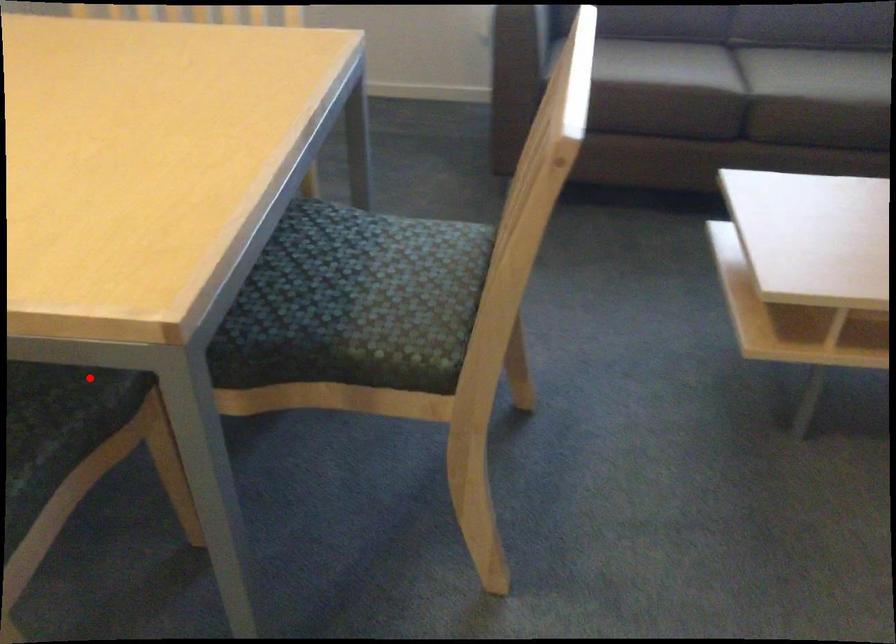
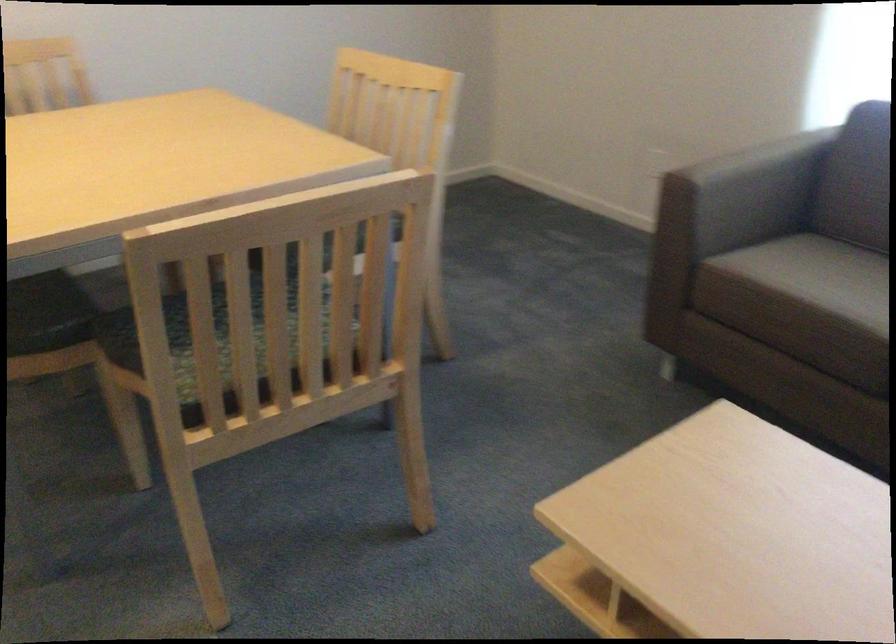
In the second image, find the point that corresponds to the highlighted location in the first image.

(47, 313)